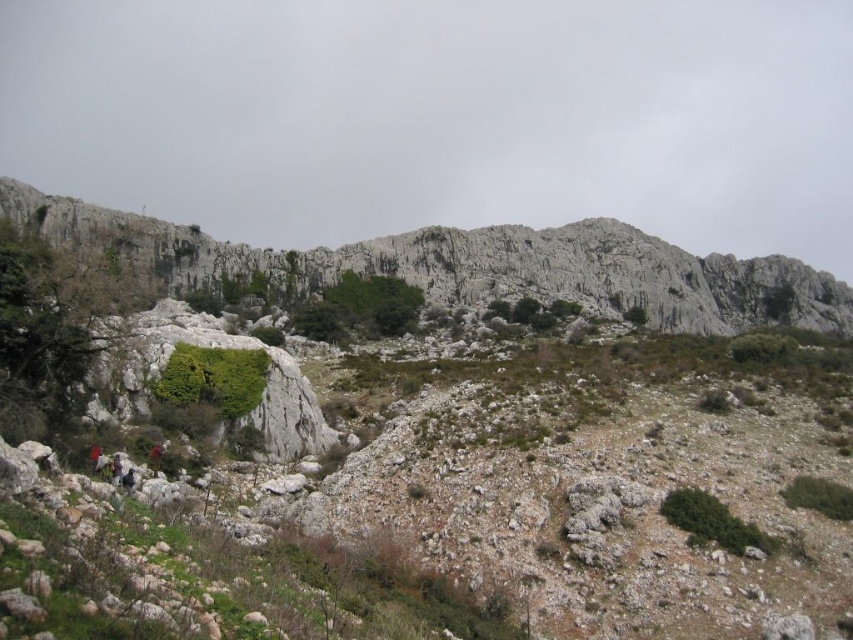
Which of these two, rugged stone mountain at upper center or red fabric person at lower left, stands shorter?

red fabric person at lower left is shorter.

Is point (770, 278) less distant than point (112, 456)?

No, (770, 278) is further to viewer.

At what (x,y) coordinates should I click in order to perform the action: click on rugged stone mountain at upper center. Please return your answer as a coordinate pair (x, y). The image size is (853, 640). Looking at the image, I should click on (474, 266).